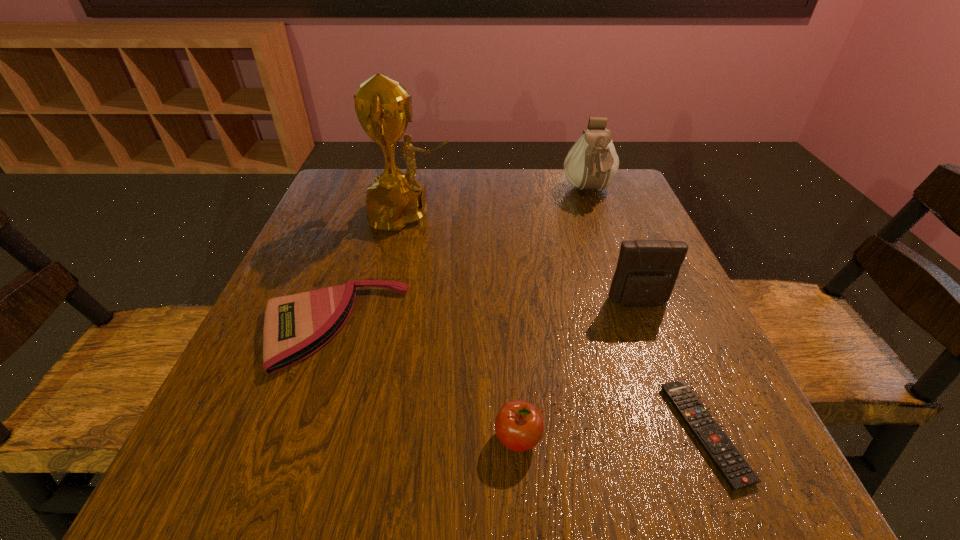
The image size is (960, 540). I want to click on object that is the fourth nearest to the third object from left to right, so click(x=383, y=107).

Locate an element on the screen. vacant space that satisfies the following two spatial constraints: 1. with an open flap on the shortest object; 2. on the left side of the fourth shortest object is located at coordinates (689, 433).

Where is `vacant position in the image that satisfies the following two spatial constraints: 1. on the front side of the tallest object; 2. on the left side of the apple`? vacant position in the image that satisfies the following two spatial constraints: 1. on the front side of the tallest object; 2. on the left side of the apple is located at coordinates (361, 438).

Find the location of a particular element. This screenshot has width=960, height=540. free region that satisfies the following two spatial constraints: 1. on the front side of the tallest object; 2. on the back side of the fourth tallest object is located at coordinates (361, 438).

Find the location of a particular element. This screenshot has width=960, height=540. vacant space that satisfies the following two spatial constraints: 1. on the front-facing side of the taller pouch; 2. on the front side of the award is located at coordinates (597, 214).

Identify the location of vacant space that satisfies the following two spatial constraints: 1. on the front side of the third shortest object; 2. on the left side of the award. The height and width of the screenshot is (540, 960). (361, 438).